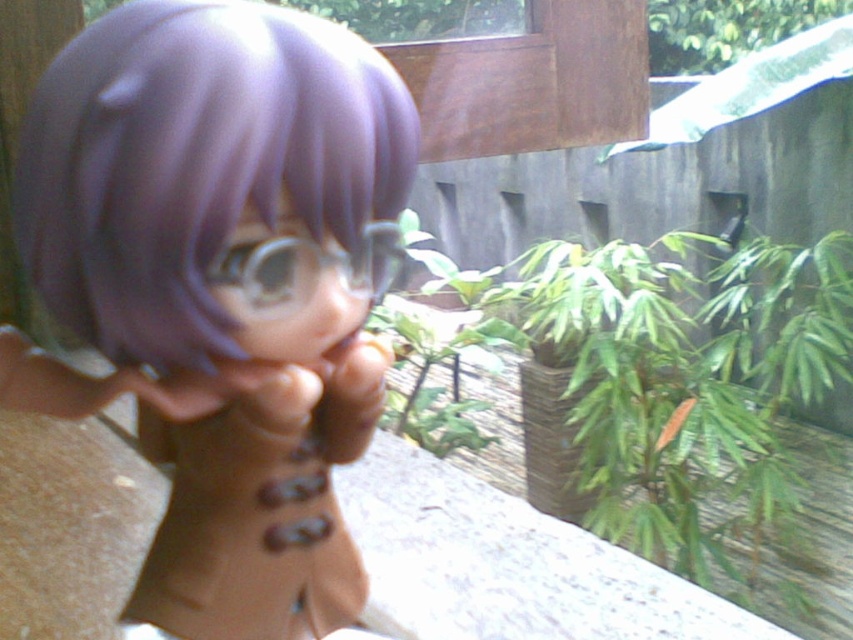
You are a delivery robot with a 2 meter long package. You need to place the package between the matte purple doll at center and the green leafy plant at upper right. Is there enough space between them to fit the package?

The distance between the matte purple doll at center and the green leafy plant at upper right is 4.72 meters. Since the package is 2 meters long, there is sufficient space to place it between them.

Based on the scene description, which green leafy plant is bigger between the green leafy plant at center and the green leafy plant at upper right?

The green leafy plant at center is larger in size than the green leafy plant at upper right.

You are holding a 16 inch ruler and want to measure the distance from your eyes to the point at coordinates point (167, 522) in the image. Can your ruler reach that distance?

The point (167, 522) is 17.65 inches from viewer. Since the ruler is only 16 inches long, it cannot reach the full distance. You would need a longer ruler or measuring tool.